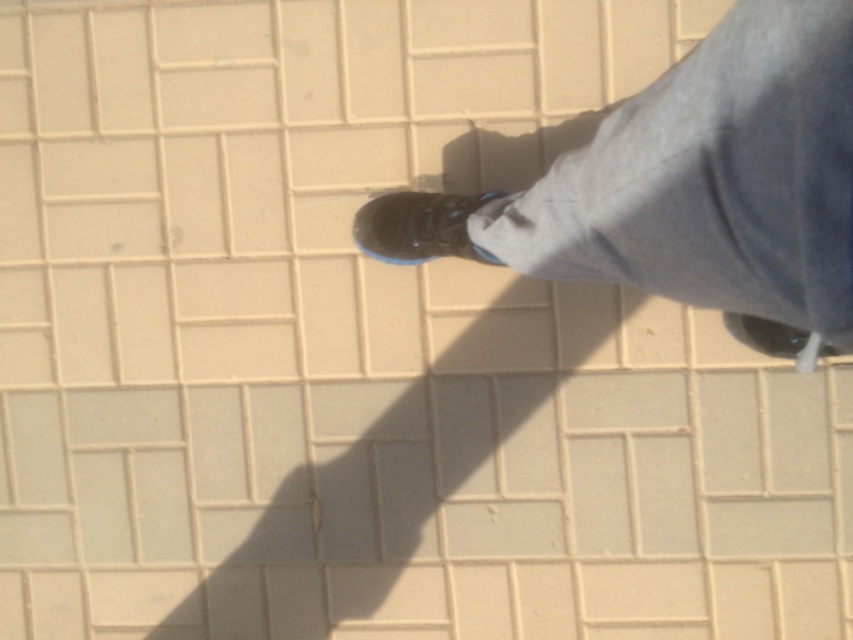
Looking at the scene where a person is standing on tiles, you see a black rubber shoe at center and a matte black shoe at lower right. Which shoe is positioned closer to the left side of the image?

The black rubber shoe at center is positioned to the left of the matte black shoe at lower right, so it is closer to the left side of the image.

You are trying to decide which of the two shoes at the center of the image to take with you on a hike. The black rubber shoe at center has better traction, but the shiny black shoe at center is lighter. Considering their sizes, which one might be more comfortable for a long walk?

The black rubber shoe at center is larger in size than the shiny black shoe at center. Since the larger shoe may provide more cushioning and space for your feet, it might be more comfortable for a long walk despite being heavier.